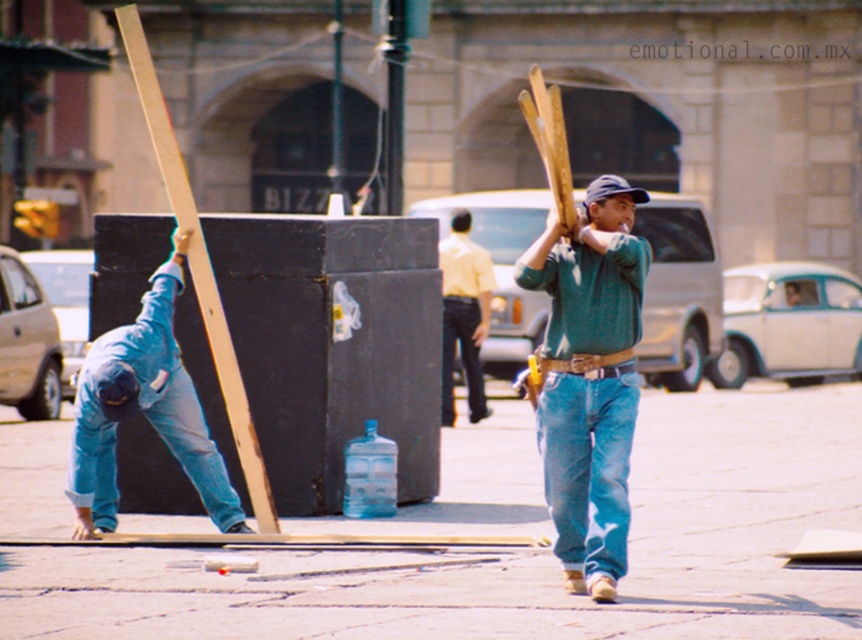
Question: Which point is closer to the camera taking this photo?

Choices:
 (A) (114, 332)
 (B) (541, 412)

Answer: (B)

Question: Can you confirm if green sweater at center is bigger than denim jeans at center?

Choices:
 (A) no
 (B) yes

Answer: (B)

Question: Which object is farther from the camera taking this photo?

Choices:
 (A) blue denim jeans at lower left
 (B) green sweater at center
 (C) yellow shirt at center

Answer: (C)

Question: Is blue denim jeans at lower left thinner than yellow shirt at center?

Choices:
 (A) no
 (B) yes

Answer: (A)

Question: Among these objects, which one is farthest from the camera?

Choices:
 (A) denim jeans at center
 (B) yellow shirt at center
 (C) green sweater at center

Answer: (B)

Question: Is blue denim jeans at lower left bigger than yellow shirt at center?

Choices:
 (A) yes
 (B) no

Answer: (A)